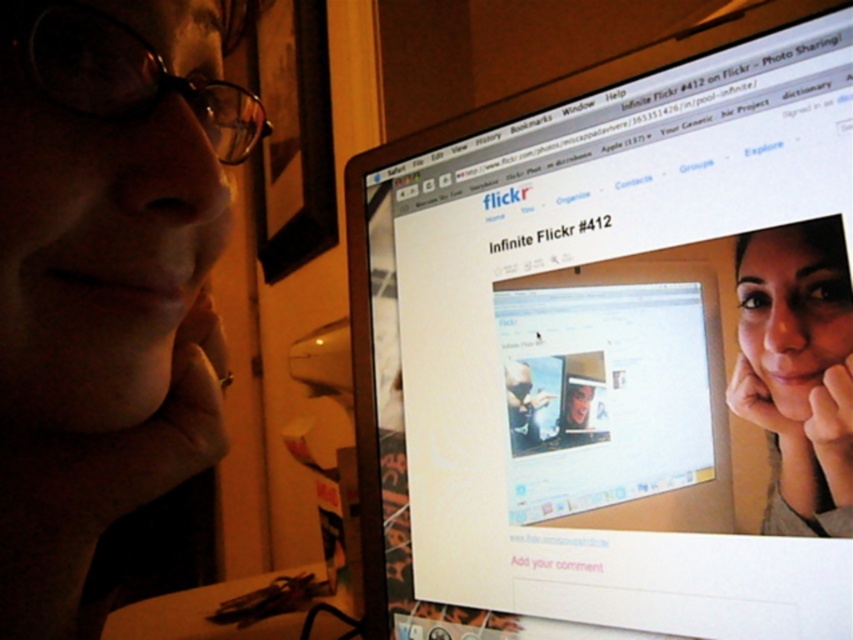
You are standing in front of the computer screen showing the Flickr webpage. There are two points marked on the screen at coordinates point (537, 520) and point (843, 460). Which point is closer to you?

Point (537, 520) is further to the camera than point (843, 460), so the point closer to you is point (843, 460).

You are a person sitting at the desk in the scene. You want to place a small sticky note on the object that is taller between the white glossy monitor at upper center and the matte skin face at center. Which object should you place it on?

The white glossy monitor at upper center is much taller than the matte skin face at center, so you should place the sticky note on the white glossy monitor at upper center.

You are designing a desk layout and want to place a small plant between the white glossy monitor at upper center and the matte skin face at center. Since the monitor is larger, where should the plant be placed to balance the visual weight?

The white glossy monitor at upper center is bigger than the matte skin face at center, so placing the plant closer to the monitor would help balance the visual weight by counteracting the larger size.